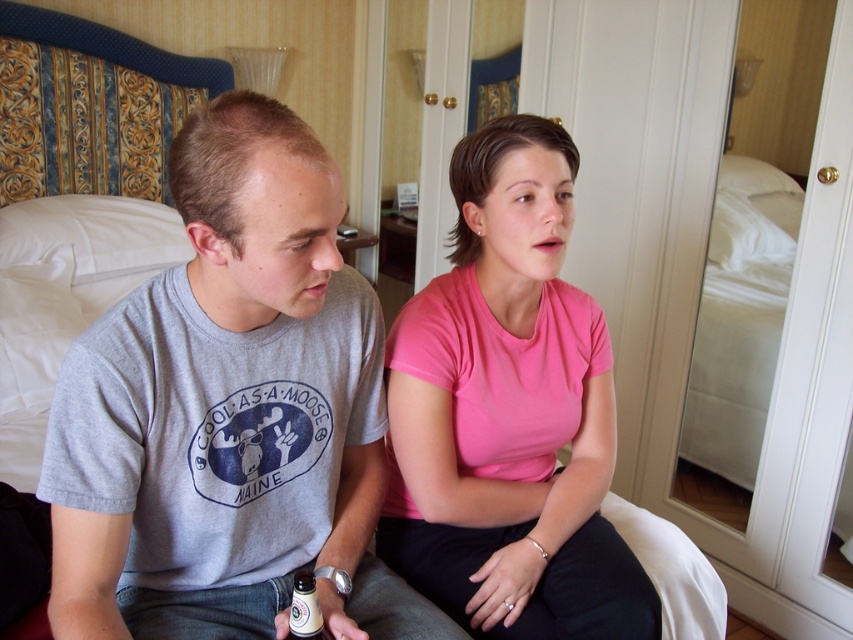
Question: Can you confirm if gray cotton t-shirt at left is smaller than pink cotton shirt at center?

Choices:
 (A) yes
 (B) no

Answer: (B)

Question: Which object appears farthest from the camera in this image?

Choices:
 (A) gray cotton t-shirt at left
 (B) pink cotton shirt at center

Answer: (B)

Question: Can you confirm if pink cotton shirt at center is positioned to the left of translucent plastic bottle at lower center?

Choices:
 (A) yes
 (B) no

Answer: (B)

Question: In this image, where is gray cotton t-shirt at left located relative to pink cotton shirt at center?

Choices:
 (A) right
 (B) left

Answer: (B)

Question: Which point appears closest to the camera in this image?

Choices:
 (A) (62, 497)
 (B) (318, 620)

Answer: (A)

Question: Among these objects, which one is farthest from the camera?

Choices:
 (A) pink cotton shirt at center
 (B) translucent plastic bottle at lower center
 (C) gray cotton t-shirt at left

Answer: (A)